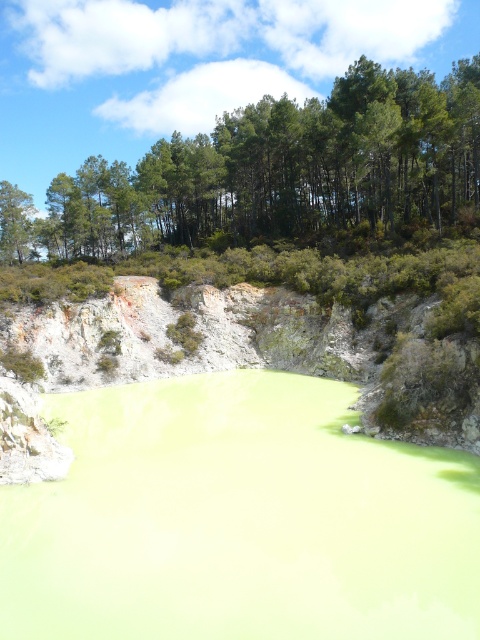
Question: Which object appears farthest from the camera in this image?

Choices:
 (A) green leafy trees at upper center
 (B) green liquid at center
 (C) greenish-yellow clay at center

Answer: (A)

Question: Can you confirm if green leafy trees at upper center is thinner than greenish-yellow clay at center?

Choices:
 (A) yes
 (B) no

Answer: (B)

Question: Based on their relative distances, which object is farther from the green leafy trees at upper center?

Choices:
 (A) green liquid at center
 (B) greenish-yellow clay at center

Answer: (A)

Question: Where is green leafy trees at upper center located in relation to greenish-yellow clay at center in the image?

Choices:
 (A) left
 (B) right

Answer: (B)

Question: Does green leafy trees at upper center appear over greenish-yellow clay at center?

Choices:
 (A) no
 (B) yes

Answer: (B)

Question: Which of the following is the farthest from the observer?

Choices:
 (A) (118, 492)
 (B) (463, 125)

Answer: (B)